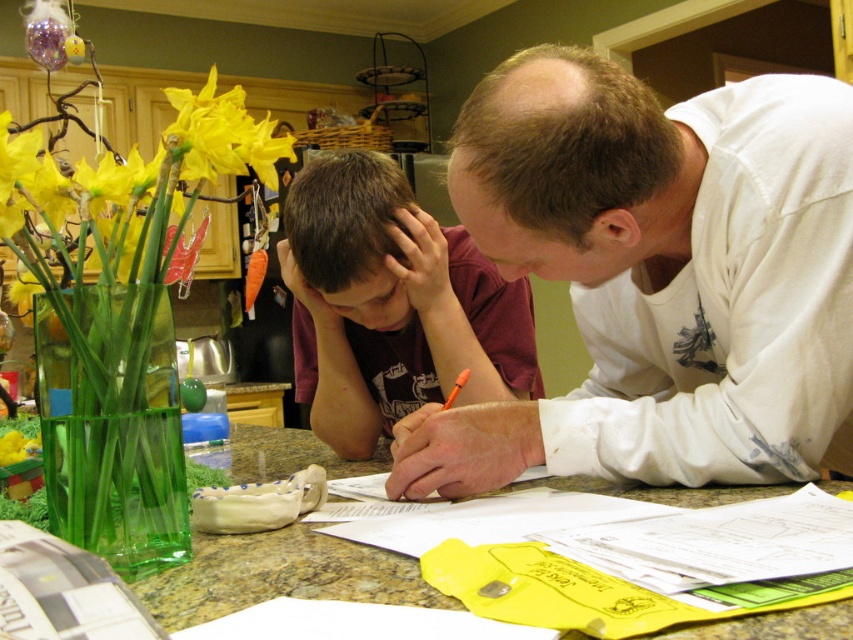
Can you confirm if dark brown hair at center is positioned above green glass vase at center?

Yes.

Does point (515, 328) come farther from viewer compared to point (404, 573)?

Yes.

You are a GUI agent. You are given a task and a screenshot of the screen. Output one action in this format:
    pyautogui.click(x=<x>, y=<y>)
    Task: Click on the dark brown hair at center
    This screenshot has width=853, height=640.
    Given the screenshot: What is the action you would take?
    pyautogui.click(x=392, y=305)

Where is `dark brown hair at center`? dark brown hair at center is located at coordinates (392, 305).

Image resolution: width=853 pixels, height=640 pixels. What do you see at coordinates (129, 189) in the screenshot?
I see `yellow matte flowers at left` at bounding box center [129, 189].

Between yellow matte flowers at left and green glass vase at center, which one is positioned lower?

green glass vase at center is lower down.

Is point (77, 200) closer to viewer compared to point (263, 564)?

No, it is not.

Image resolution: width=853 pixels, height=640 pixels. I want to click on yellow matte flowers at left, so click(x=129, y=189).

Which is in front, point (450, 156) or point (276, 435)?

Positioned in front is point (276, 435).

Is the position of white cotton shirt at upper right less distant than that of green glass vase at center?

No, white cotton shirt at upper right is behind green glass vase at center.

Does point (521, 104) come farther from viewer compared to point (347, 556)?

That is True.

Find the location of `white cotton shirt at upper right`. white cotton shirt at upper right is located at coordinates (656, 275).